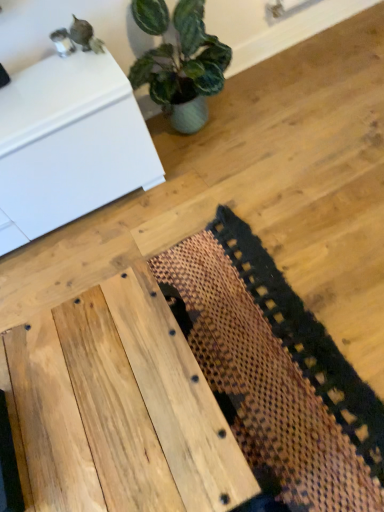
In order to click on free space between white glossy cabinet at upper left and brown woven mat at center in this screenshot , I will do `click(100, 236)`.